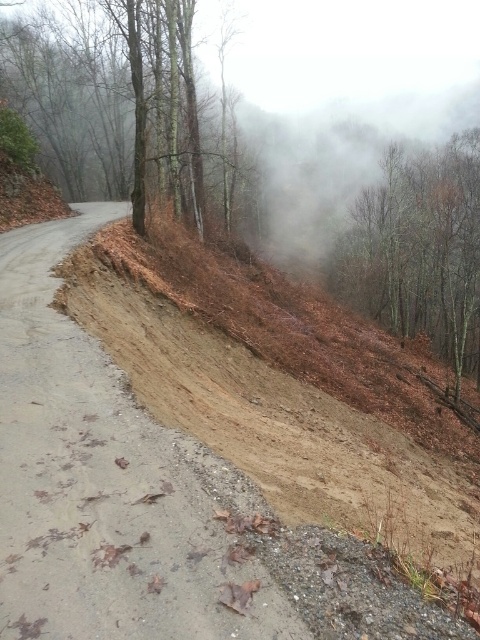
You are a hiker planning to walk along the brown sandy dirt track at center and pass by the brown matte tree at upper right. Based on the scene, will the tree be above or below you as you walk along the track?

The brown sandy dirt track at center is positioned under the brown matte tree at upper right, so as you walk along the track, the tree will be above you.

You are driving along the road and want to know if the brown sandy dirt track at center is closer to you than the brown matte tree at upper right. Based on the scene, can you determine this?

The brown sandy dirt track at center is in front of the brown matte tree at upper right, so yes, the brown sandy dirt track at center is closer to you than the brown matte tree at upper right.

You are standing at the edge of the road in the rural scene. You notice two points marked on the embankment. Which point, point (x=75, y=369) or point (x=142, y=106), is nearer to your current position?

Point (x=75, y=369) is closer to the camera than point (x=142, y=106), so it is nearer to your current position.